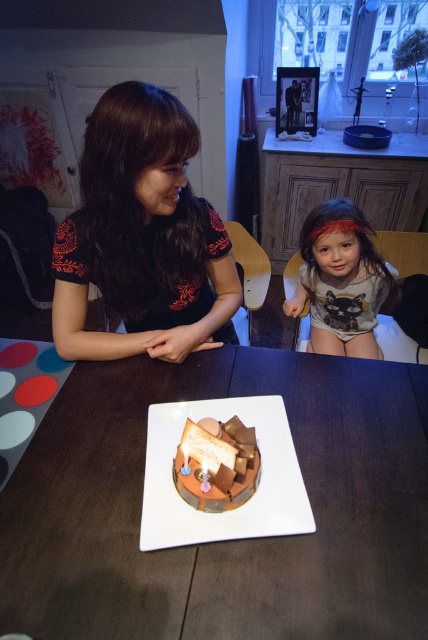
Between matte black dress at upper left and gray cotton shirt at center, which one appears on the left side from the viewer's perspective?

From the viewer's perspective, matte black dress at upper left appears more on the left side.

Consider the image. Is matte black dress at upper left further to camera compared to gray cotton shirt at center?

No, it is in front of gray cotton shirt at center.

Who is more distant from viewer, (113,204) or (326,305)?

The point (326,305) is more distant.

This screenshot has height=640, width=428. Find the location of `matte black dress at upper left`. matte black dress at upper left is located at coordinates (142, 237).

Which is below, gray cotton shirt at center or chocolatesmoothcake at center?

Positioned lower is chocolatesmoothcake at center.

Does gray cotton shirt at center have a smaller size compared to chocolatesmoothcake at center?

Incorrect, gray cotton shirt at center is not smaller in size than chocolatesmoothcake at center.

Identify the location of gray cotton shirt at center. The width and height of the screenshot is (428, 640). (339, 280).

Which is behind, point (213, 221) or point (193, 426)?

The point (213, 221) is behind.

Who is taller, matte black dress at upper left or chocolatesmoothcake at center?

Standing taller between the two is matte black dress at upper left.

Describe the element at coordinates (142, 237) in the screenshot. I see `matte black dress at upper left` at that location.

At what (x,y) coordinates should I click in order to perform the action: click on matte black dress at upper left. Please return your answer as a coordinate pair (x, y). This screenshot has height=640, width=428. Looking at the image, I should click on (142, 237).